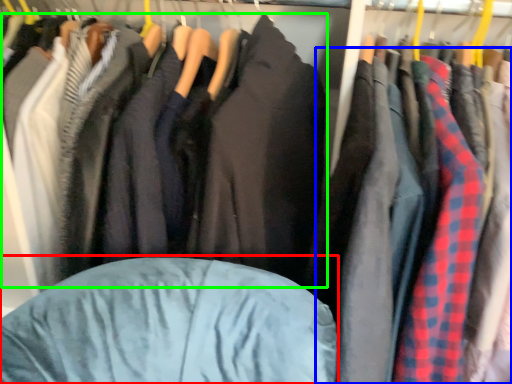
Question: Which is farther away from bean bag chair (highlighted by a red box)? clothing (highlighted by a blue box) or jacket (highlighted by a green box)?

Choices:
 (A) clothing
 (B) jacket

Answer: (A)